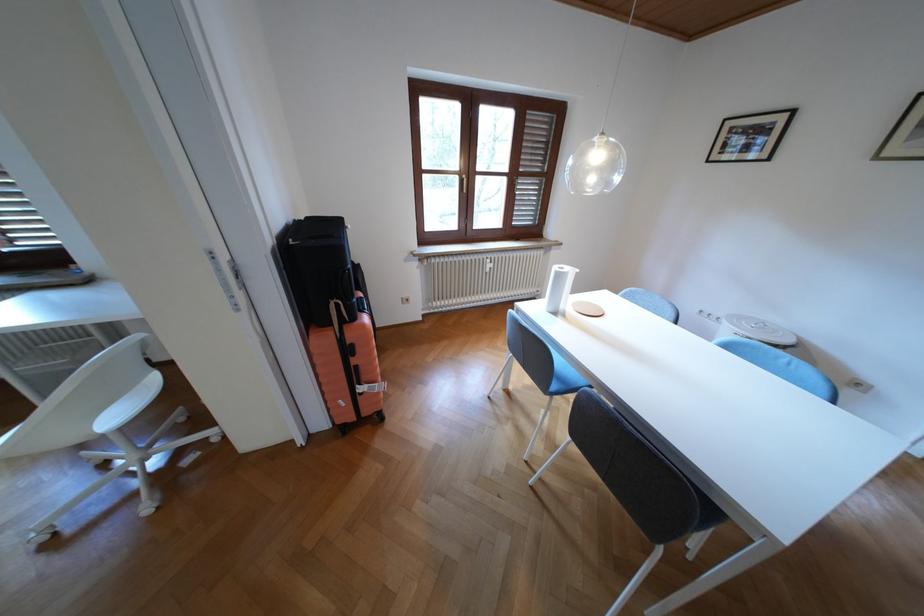
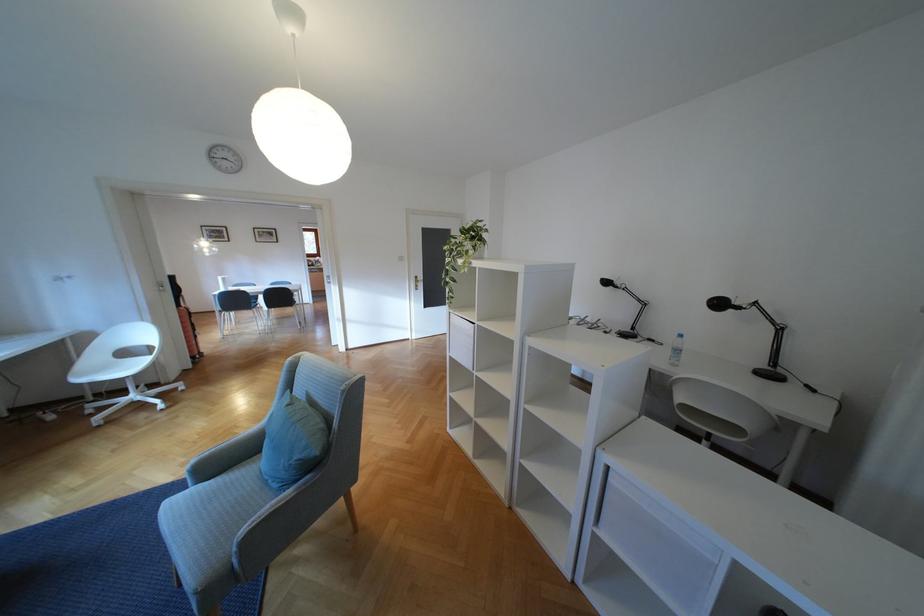
Question: I am providing you with two images of the same scene from different viewpoints. Which of the following objects are not visible in image2?

Choices:
 (A) black desk lamp
 (B) white round lid
 (C) blue cushion
 (D) folded eyeglasses

Answer: (B)